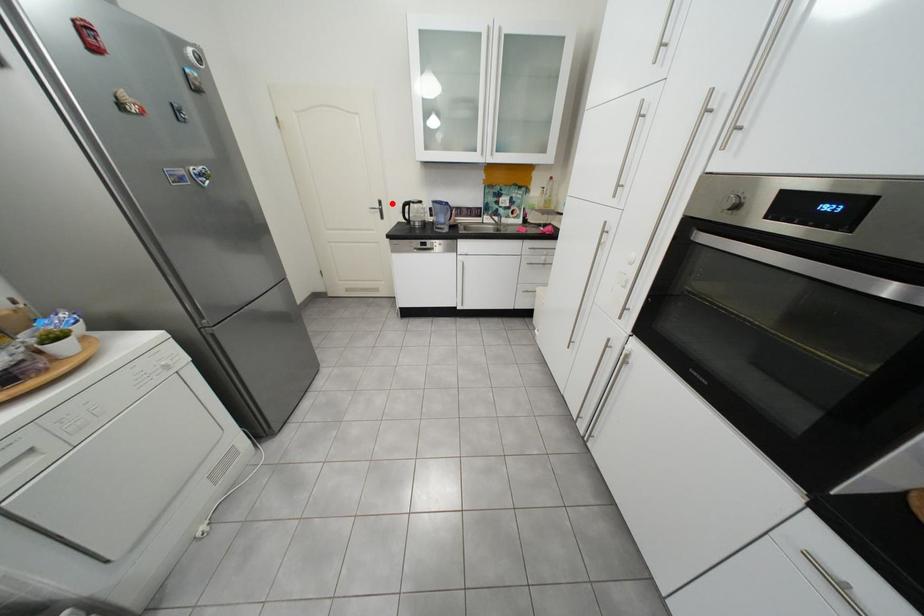
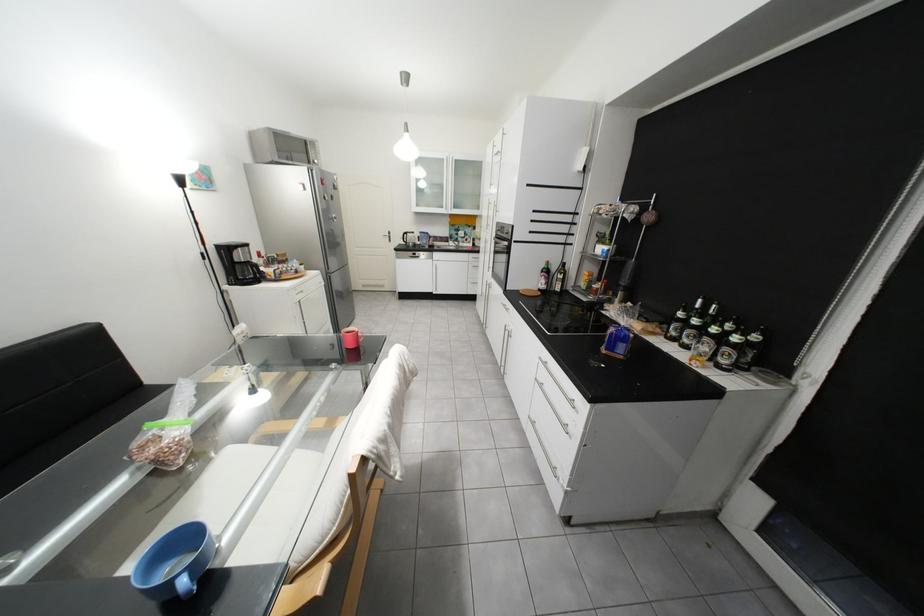
Question: I am providing you with two images of the same scene from different viewpoints. A red point is marked on the first image. Can you still see the location of the red point in image 2?

Choices:
 (A) Yes
 (B) No

Answer: (A)